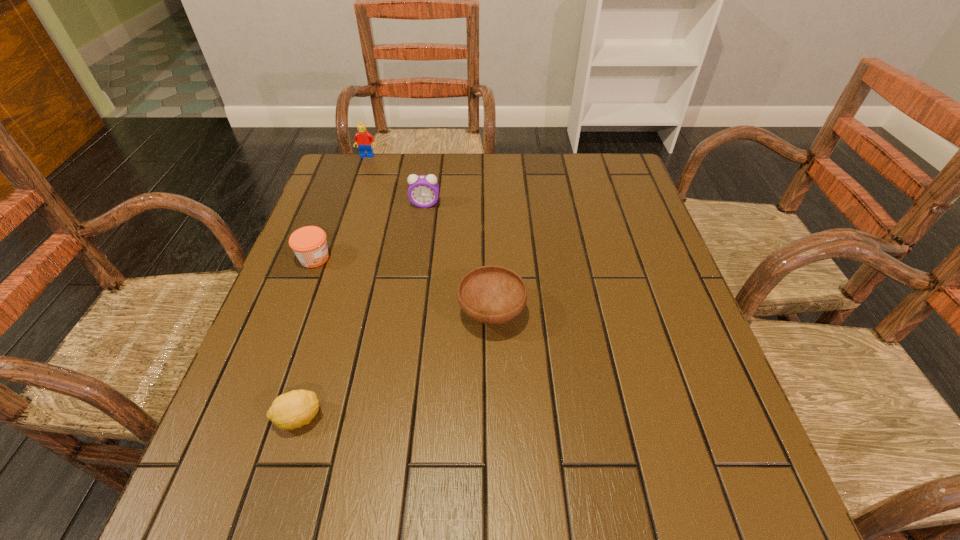
You are a GUI agent. You are given a task and a screenshot of the screen. Output one action in this format:
    pyautogui.click(x=<x>, y=<y>)
    Task: Click on the tallest object
    
    Given the screenshot: What is the action you would take?
    pyautogui.click(x=364, y=140)

I want to click on the farthest object, so click(364, 140).

The width and height of the screenshot is (960, 540). What are the coordinates of `the second object from right to left` in the screenshot? It's located at (423, 191).

At what (x,y) coordinates should I click in order to perform the action: click on the second tallest object. Please return your answer as a coordinate pair (x, y). Looking at the image, I should click on (423, 191).

Where is `the second nearest object`? the second nearest object is located at coordinates (491, 294).

Locate an element on the screen. The height and width of the screenshot is (540, 960). the rightmost object is located at coordinates pos(491,294).

Identify the location of jam. (309, 243).

Identify the location of the nearest object. (291, 410).

The width and height of the screenshot is (960, 540). What are the coordinates of `free space located 0.210m on the face of the Lego` in the screenshot? It's located at (353, 198).

At what (x,y) coordinates should I click in order to perform the action: click on free space located on the face of the fourth object from left to right. Please return your answer as a coordinate pair (x, y). Image resolution: width=960 pixels, height=540 pixels. Looking at the image, I should click on (415, 274).